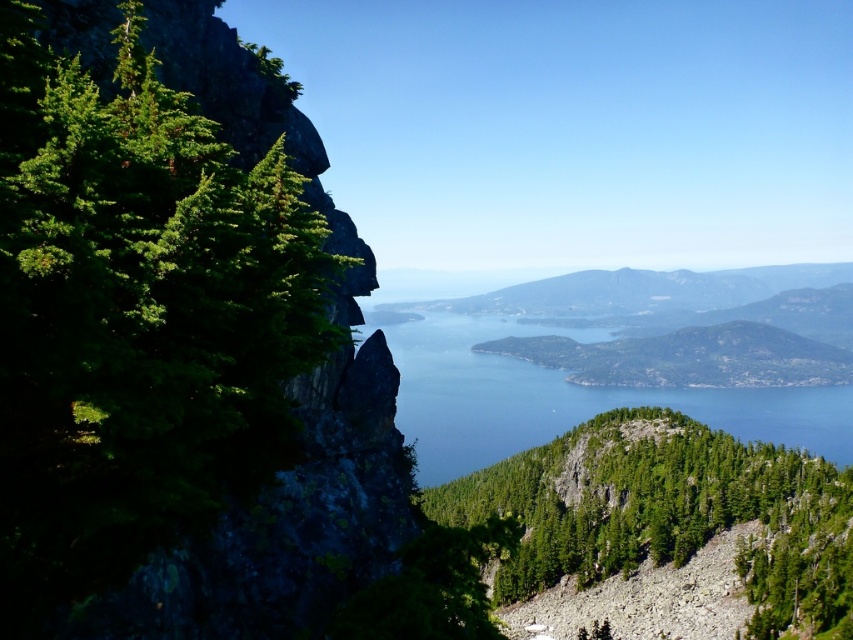
You are standing at the base of the cliff on the left side of the image and want to reach the distant hills on the right. You have two markers, one at point (459, 524) and another at point (544, 404). Which marker is closer to you?

Point (459, 524) is closer to the viewer than point (544, 404), so the marker at point (459, 524) is closer to you.

You are a hiker standing at the base of the green rough textured tree at center. You want to reach the top of the tree to get a better view. The tree is 30.76 meters tall. Do you think you can climb it if your maximum climbing height is 30 meters?

The green rough textured tree at center and viewer are 30.76 meters apart from each other. Since the tree is 30.76 meters tall and your maximum climbing height is 30 meters, you cannot reach the top.

You are a hiker planning to cross the blue water at center using a small raft. The green rough textured tree at center is blocking your path. Can you navigate around it without the raft getting stuck?

The green rough textured tree at center has a lesser width compared to blue water at center, so yes, you can navigate around it since the water is wider than the tree.